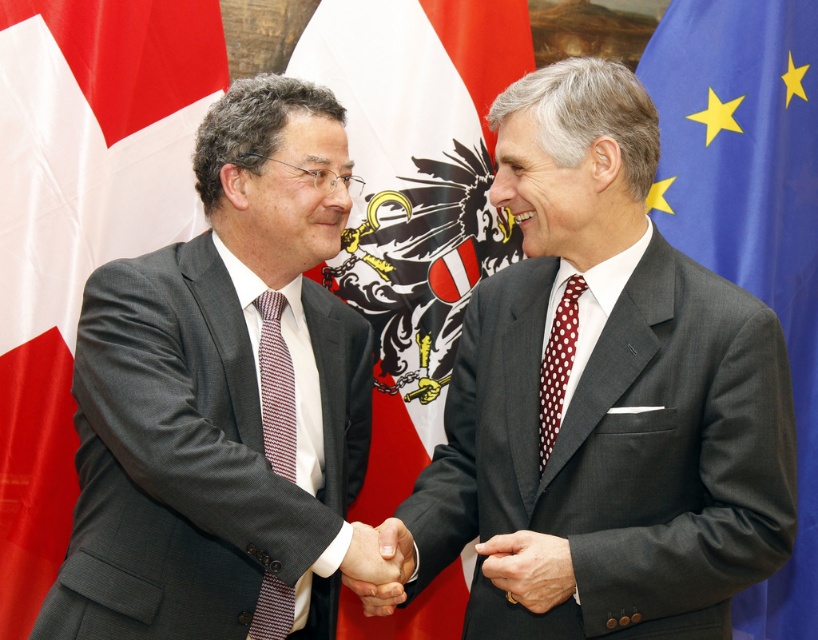
Question: Which is nearer to the smooth skin handshake at center?

Choices:
 (A) matte black suit at left
 (B) blue fabric flag at right

Answer: (A)

Question: Can you confirm if red fabric flag at left is positioned above smooth skin handshake at center?

Choices:
 (A) no
 (B) yes

Answer: (B)

Question: Which point is farther from the camera taking this photo?

Choices:
 (A) (676, 344)
 (B) (531, 548)
 (C) (81, 108)

Answer: (C)

Question: Does smooth leather hand at center appear on the left side of smooth skin handshake at center?

Choices:
 (A) no
 (B) yes

Answer: (A)

Question: Does blue fabric flag at right appear on the right side of white dotted silk tie at center?

Choices:
 (A) yes
 (B) no

Answer: (A)

Question: Which point is farther to the camera?

Choices:
 (A) blue fabric flag at right
 (B) white fabric flag at center

Answer: (B)